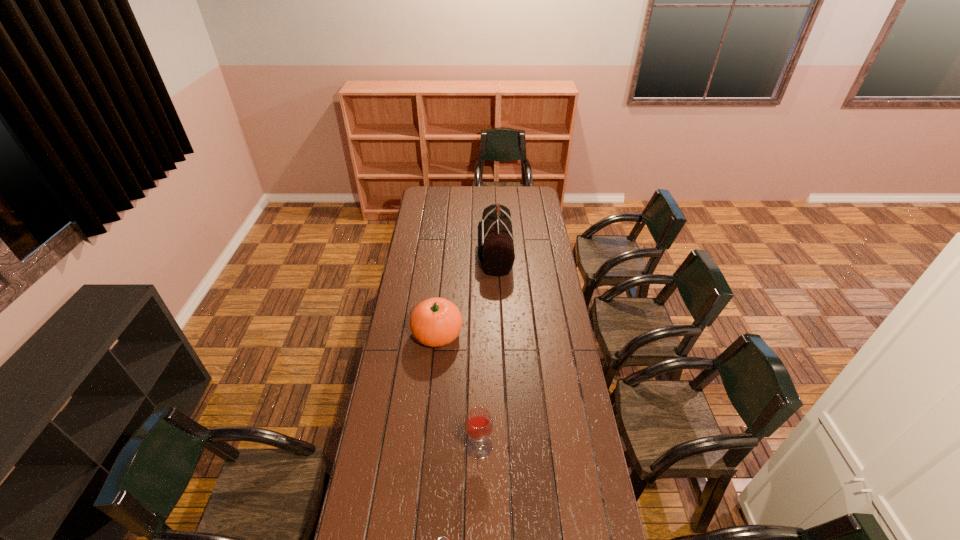
You are a GUI agent. You are given a task and a screenshot of the screen. Output one action in this format:
    pyautogui.click(x=<x>, y=<y>)
    Task: Click on the blank area at the left edge
    This screenshot has height=540, width=960.
    Given the screenshot: What is the action you would take?
    pyautogui.click(x=420, y=237)

Image resolution: width=960 pixels, height=540 pixels. I want to click on free point at the right edge, so click(x=533, y=221).

Find the location of a particular element. The width and height of the screenshot is (960, 540). free space at the far left corner is located at coordinates (441, 200).

Where is `free space at the far right corner of the desktop`? The height and width of the screenshot is (540, 960). free space at the far right corner of the desktop is located at coordinates (525, 194).

Image resolution: width=960 pixels, height=540 pixels. Find the location of `free spot between the wineglass and the second farthest object`. free spot between the wineglass and the second farthest object is located at coordinates (458, 390).

I want to click on vacant region between the wineglass and the duffel bag, so click(x=487, y=350).

At what (x,y) coordinates should I click in order to perform the action: click on blank region between the pumpkin and the tallest object. Please return your answer as a coordinate pair (x, y). The height and width of the screenshot is (540, 960). Looking at the image, I should click on (466, 294).

Find the location of a particular element. empty space that is in between the farthest object and the second farthest object is located at coordinates (466, 294).

The width and height of the screenshot is (960, 540). In order to click on free space between the wineglass and the farthest object in this screenshot , I will do `click(487, 350)`.

Identify the location of empty location between the second farthest object and the wineglass. The height and width of the screenshot is (540, 960). (458, 390).